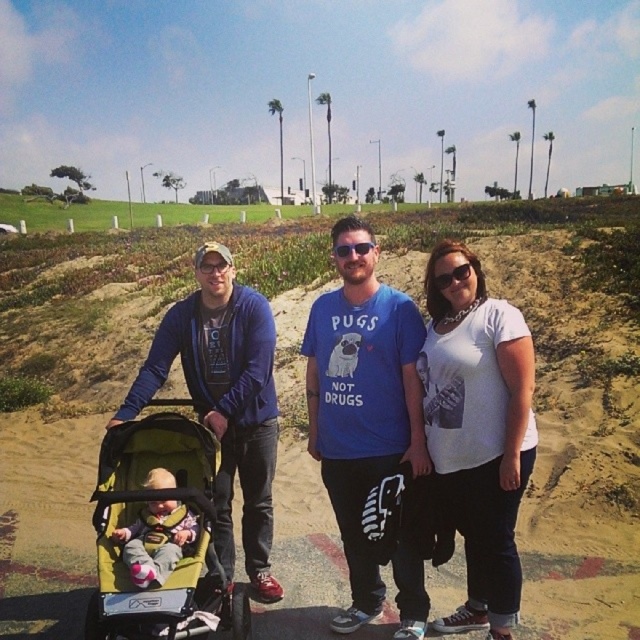
You are a photographer trying to capture a photo of the group. You need to position yourself so that the white cotton shirt at center and the green fabric stroller at lower left are both clearly visible in the frame. Based on their positions, which side of the stroller should you stand to ensure both are in view?

Since the white cotton shirt at center is to the right of the green fabric stroller at lower left, you should position yourself to the left side of the green fabric stroller at lower left to include both the white cotton shirt at center and the stroller in the frame.

You are a photographer trying to capture a photo of the white cotton shirt at center and the green fabric stroller at lower left. To ensure both are in focus, you need to know which one is taller. Can you tell me which object is taller?

The white cotton shirt at center is taller than the green fabric stroller at lower left according to the description provided.

You are a photographer trying to capture a photo of the two central figures in the scene. The white cotton shirt at center and the soft yellow fabric at center are both in your frame. Based on their positions, which one will appear larger in the photo?

The white cotton shirt at center will appear larger in the photo because it has a greater height compared to the soft yellow fabric at center.